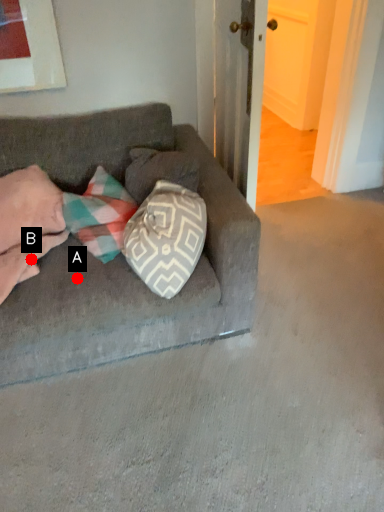
Question: Two points are circled on the image, labeled by A and B beside each circle. Which point appears farthest from the camera in this image?

Choices:
 (A) A is further
 (B) B is further

Answer: (B)